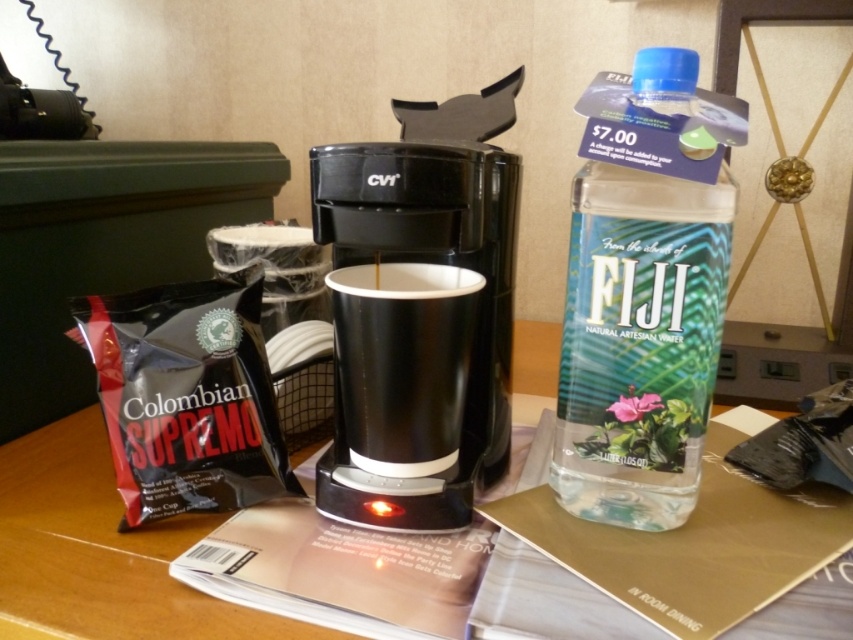
Can you confirm if black plastic coffee maker at center is bigger than black matte cup at center?

Yes, black plastic coffee maker at center is bigger than black matte cup at center.

Does black plastic coffee maker at center have a lesser width compared to black matte cup at center?

In fact, black plastic coffee maker at center might be wider than black matte cup at center.

Which is behind, point (424, 131) or point (357, 308)?

The point (424, 131) is behind.

You are a GUI agent. You are given a task and a screenshot of the screen. Output one action in this format:
    pyautogui.click(x=<x>, y=<y>)
    Task: Click on the black plastic coffee maker at center
    This screenshot has height=640, width=853.
    Given the screenshot: What is the action you would take?
    pyautogui.click(x=421, y=310)

Can you confirm if black plastic coffee maker at center is positioned above black matte bag of colombian supremo coffee at lower left?

Yes.

Between black plastic coffee maker at center and black matte bag of colombian supremo coffee at lower left, which one appears on the right side from the viewer's perspective?

black plastic coffee maker at center

Which is behind, point (405, 449) or point (247, 368)?

The point (247, 368) is behind.

Image resolution: width=853 pixels, height=640 pixels. What are the coordinates of `black plastic coffee maker at center` in the screenshot? It's located at (421, 310).

Which is more to the right, black matte bag of colombian supremo coffee at lower left or black matte cup at center?

Positioned to the right is black matte cup at center.

Which is behind, point (181, 292) or point (456, 355)?

Positioned behind is point (181, 292).

This screenshot has height=640, width=853. What do you see at coordinates (186, 396) in the screenshot? I see `black matte bag of colombian supremo coffee at lower left` at bounding box center [186, 396].

At what (x,y) coordinates should I click in order to perform the action: click on black matte bag of colombian supremo coffee at lower left. Please return your answer as a coordinate pair (x, y). Looking at the image, I should click on (186, 396).